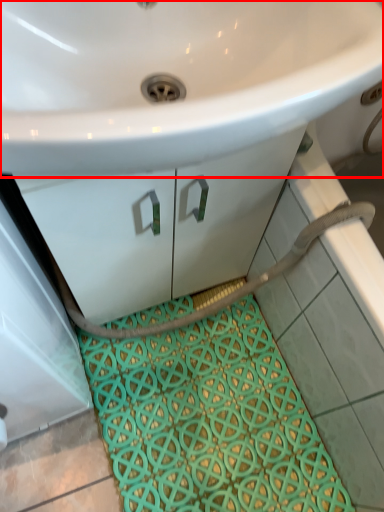
Question: From the image's perspective, what is the correct spatial positioning of sink (annotated by the red box) in reference to bath mat?

Choices:
 (A) below
 (B) above

Answer: (B)